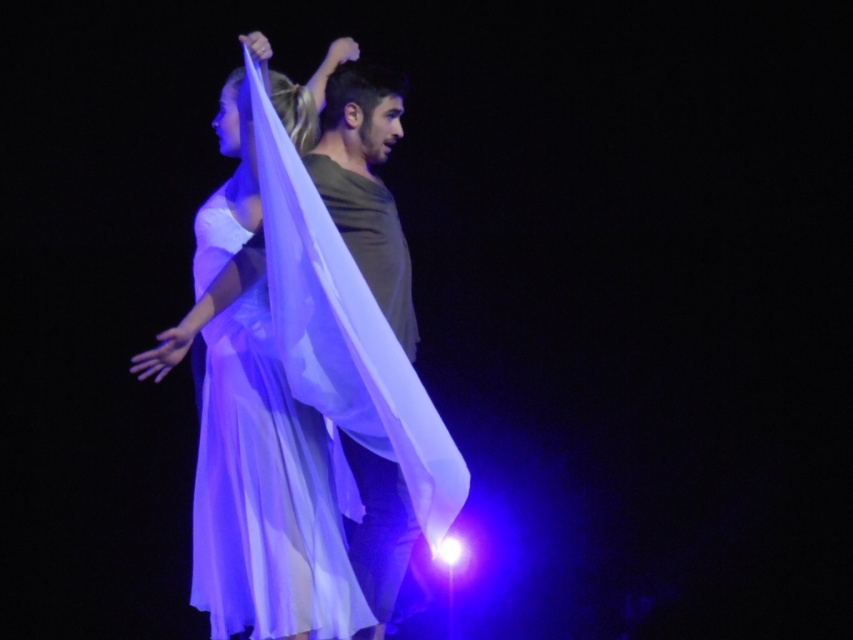
You are a stagehand preparing to adjust the lighting for the performance. The translucent white fabric at center is positioned in front of the main spotlight. Given that the spotlight has a maximum reach of 9 feet, will the fabric be illuminated effectively?

The translucent white fabric at center is 8.96 feet from viewer, which is within the spotlight maximum reach of 9 feet. Therefore, the fabric will be illuminated effectively.

You are standing in the audience and want to take a photo of the point at coordinates (306, 225). The camera you are using has a minimum focus distance of 10 feet. Will the camera be able to focus on that point?

The point at coordinates (306, 225) is 9.38 feet away from the camera, which is within the camera minimum focus distance of 10 feet. Therefore, the camera can focus on that point.

You are a stagehand who needs to adjust the distance between the translucent white fabric at center and the translucent silk dress at center to exactly 3 inches. Based on the current setup, is the current distance sufficient or does it need adjustment?

The current distance between the translucent white fabric at center and the translucent silk dress at center is 3.01 inches, which is slightly more than the required 3 inches. Therefore, a minor adjustment is needed to reduce the distance by 0.01 inches to meet the exact requirement.